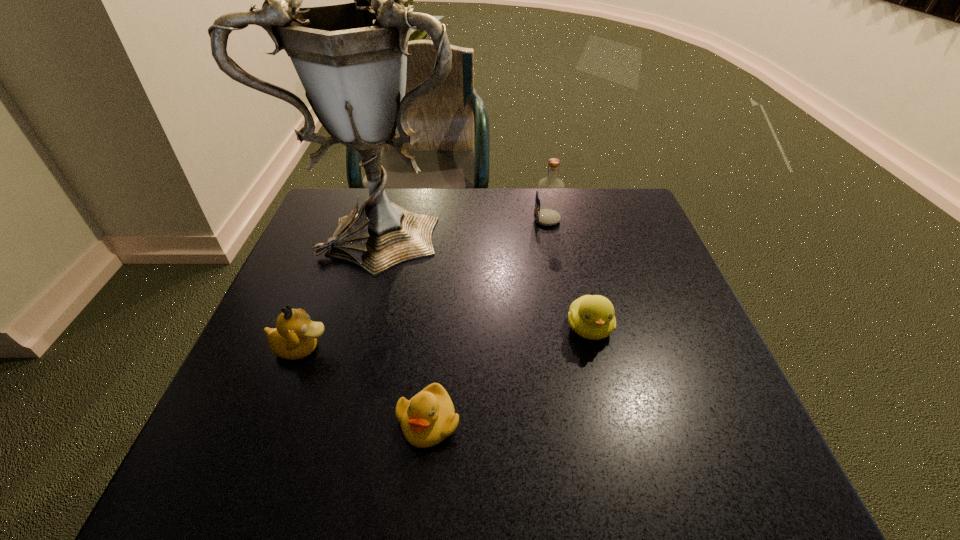
This screenshot has width=960, height=540. What are the coordinates of `vacant area at the near edge of the desktop` in the screenshot? It's located at (480, 458).

The image size is (960, 540). I want to click on free spot at the left edge of the desktop, so click(x=311, y=360).

The image size is (960, 540). I want to click on vacant space at the right edge of the desktop, so 722,420.

In the image, there is a desktop. In order to click on free space at the near left corner in this screenshot , I will do `click(234, 451)`.

This screenshot has height=540, width=960. In the image, there is a desktop. Identify the location of vacant space at the far right corner. (596, 224).

You are a GUI agent. You are given a task and a screenshot of the screen. Output one action in this format:
    pyautogui.click(x=<x>, y=<y>)
    Task: Click on the vacant area that lies between the trophy cup and the second duckling from left to right
    This screenshot has height=540, width=960.
    Given the screenshot: What is the action you would take?
    pyautogui.click(x=407, y=324)

In order to click on vacant space that's between the tallest object and the vodka in this screenshot , I will do `click(467, 224)`.

Identify the location of free space between the trophy cup and the leftmost duckling. (344, 288).

This screenshot has height=540, width=960. In order to click on free space between the rightmost duckling and the leftmost duckling in this screenshot , I will do `click(445, 338)`.

Where is `free space between the trophy cup and the leftmost duckling`? free space between the trophy cup and the leftmost duckling is located at coordinates (344, 288).